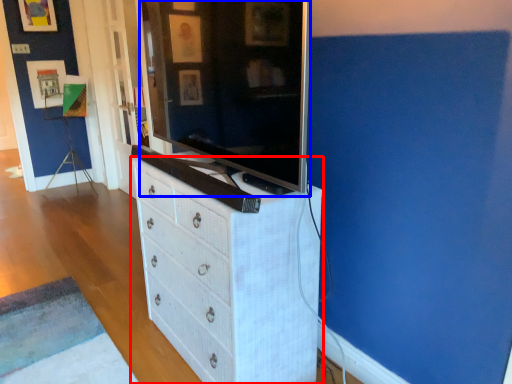
Question: Among these objects, which one is nearest to the camera, chest of drawers (highlighted by a red box) or television (highlighted by a blue box)?

Choices:
 (A) chest of drawers
 (B) television

Answer: (B)